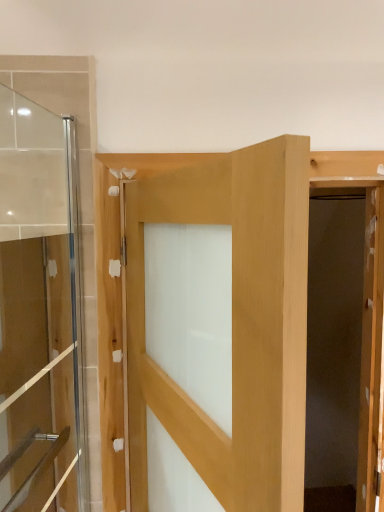
This screenshot has height=512, width=384. In order to click on natural wood door at center, the second door from the left in this screenshot , I will do `click(232, 318)`.

Measure the distance between point (165,422) and camera.

36.57 inches.

Describe the element at coordinates (232, 318) in the screenshot. I see `natural wood door at center, the second door from the left` at that location.

The width and height of the screenshot is (384, 512). In order to click on transparent glass door at left, the 1th door in the left-to-right sequence in this screenshot , I will do `click(39, 312)`.

What is the approximate height of transparent glass door at left, which is the 2th door from right to left?

transparent glass door at left, which is the 2th door from right to left, is 3.83 feet in height.

Measure the distance between point [3,108] and camera.

The depth of point [3,108] is 3.76 feet.

What do you see at coordinates (39, 312) in the screenshot? I see `transparent glass door at left, the 1th door in the left-to-right sequence` at bounding box center [39, 312].

What are the coordinates of `natural wood door at center, the second door from the left` in the screenshot? It's located at (232, 318).

Considering the positions of objects natural wood door at center, the second door from the left, and transparent glass door at left, which is the 2th door from right to left, in the image provided, who is more to the left, natural wood door at center, the second door from the left, or transparent glass door at left, which is the 2th door from right to left,?

transparent glass door at left, which is the 2th door from right to left.

Is natural wood door at center, the second door from the left, positioned behind transparent glass door at left, which is the 2th door from right to left?

No, natural wood door at center, the second door from the left, is in front of transparent glass door at left, which is the 2th door from right to left.

Considering the points (139, 175) and (7, 272), which point is in front, point (139, 175) or point (7, 272)?

The point (7, 272) is closer.

From the image's perspective, which one is positioned lower, natural wood door at center, the first door when ordered from right to left, or transparent glass door at left, the 1th door in the left-to-right sequence?

natural wood door at center, the first door when ordered from right to left, from the image's perspective.

From a real-world perspective, is natural wood door at center, the second door from the left, positioned above or below transparent glass door at left, which is the 2th door from right to left?

In terms of real-world spatial position, natural wood door at center, the second door from the left, is below transparent glass door at left, which is the 2th door from right to left.

Can you confirm if natural wood door at center, the first door when ordered from right to left, is wider than transparent glass door at left, which is the 2th door from right to left?

Correct, the width of natural wood door at center, the first door when ordered from right to left, exceeds that of transparent glass door at left, which is the 2th door from right to left.

Between natural wood door at center, the second door from the left, and transparent glass door at left, the 1th door in the left-to-right sequence, which one has more height?

transparent glass door at left, the 1th door in the left-to-right sequence.

Based on their sizes in the image, would you say natural wood door at center, the second door from the left, is bigger or smaller than transparent glass door at left, which is the 2th door from right to left?

natural wood door at center, the second door from the left, is bigger than transparent glass door at left, which is the 2th door from right to left.

Is natural wood door at center, the first door when ordered from right to left, positioned beyond the bounds of transparent glass door at left, which is the 2th door from right to left?

Yes, natural wood door at center, the first door when ordered from right to left, is outside of transparent glass door at left, which is the 2th door from right to left.

Is natural wood door at center, the second door from the left, beside transparent glass door at left, the 1th door in the left-to-right sequence?

natural wood door at center, the second door from the left, is not next to transparent glass door at left, the 1th door in the left-to-right sequence, and they're not touching.

Looking at this image, could you tell me if natural wood door at center, the second door from the left, is facing transparent glass door at left, the 1th door in the left-to-right sequence?

Yes, natural wood door at center, the second door from the left, is turned towards transparent glass door at left, the 1th door in the left-to-right sequence.

How far apart are natural wood door at center, the second door from the left, and transparent glass door at left, the 1th door in the left-to-right sequence?

A distance of 11.63 inches exists between natural wood door at center, the second door from the left, and transparent glass door at left, the 1th door in the left-to-right sequence.

In the image, there is a transparent glass door at left, the 1th door in the left-to-right sequence. Identify the location of door below it (from a real-world perspective). (232, 318).

In the scene shown: Is transparent glass door at left, the 1th door in the left-to-right sequence, to the right of natural wood door at center, the first door when ordered from right to left, from the viewer's perspective?

Answer: In fact, transparent glass door at left, the 1th door in the left-to-right sequence, is to the left of natural wood door at center, the first door when ordered from right to left.

Looking at this image, which object is further away from the camera, transparent glass door at left, the 1th door in the left-to-right sequence, or natural wood door at center, the second door from the left?

Positioned behind is transparent glass door at left, the 1th door in the left-to-right sequence.

Is point (62, 146) more distant than point (294, 185)?

Yes, it is.

From the image's perspective, between transparent glass door at left, which is the 2th door from right to left, and natural wood door at center, the first door when ordered from right to left, which one is located above?

From the image's view, transparent glass door at left, which is the 2th door from right to left, is above.

From a real-world perspective, who is located higher, transparent glass door at left, the 1th door in the left-to-right sequence, or natural wood door at center, the second door from the left?

transparent glass door at left, the 1th door in the left-to-right sequence.

Which object is wider, transparent glass door at left, the 1th door in the left-to-right sequence, or natural wood door at center, the second door from the left?

With larger width is natural wood door at center, the second door from the left.

Does transparent glass door at left, the 1th door in the left-to-right sequence, have a lesser height compared to natural wood door at center, the second door from the left?

No, transparent glass door at left, the 1th door in the left-to-right sequence, is not shorter than natural wood door at center, the second door from the left.

Considering the relative sizes of transparent glass door at left, which is the 2th door from right to left, and natural wood door at center, the first door when ordered from right to left, in the image provided, is transparent glass door at left, which is the 2th door from right to left, smaller than natural wood door at center, the first door when ordered from right to left,?

Correct, transparent glass door at left, which is the 2th door from right to left, occupies less space than natural wood door at center, the first door when ordered from right to left.

Is transparent glass door at left, which is the 2th door from right to left, not within natural wood door at center, the second door from the left?

Yes, transparent glass door at left, which is the 2th door from right to left, is located beyond the bounds of natural wood door at center, the second door from the left.

Is there a large distance between transparent glass door at left, the 1th door in the left-to-right sequence, and natural wood door at center, the second door from the left?

No, transparent glass door at left, the 1th door in the left-to-right sequence, is not far from natural wood door at center, the second door from the left.

Could you tell me if transparent glass door at left, which is the 2th door from right to left, is facing natural wood door at center, the first door when ordered from right to left?

Yes, transparent glass door at left, which is the 2th door from right to left, is oriented towards natural wood door at center, the first door when ordered from right to left.

Locate an element on the screen. door that appears above the natural wood door at center, the first door when ordered from right to left (from the image's perspective) is located at coordinates (39, 312).

I want to click on door behind the natural wood door at center, the first door when ordered from right to left, so click(x=39, y=312).

At what (x,y) coordinates should I click in order to perform the action: click on door on the right of transparent glass door at left, the 1th door in the left-to-right sequence. Please return your answer as a coordinate pair (x, y). The width and height of the screenshot is (384, 512). Looking at the image, I should click on pyautogui.click(x=232, y=318).